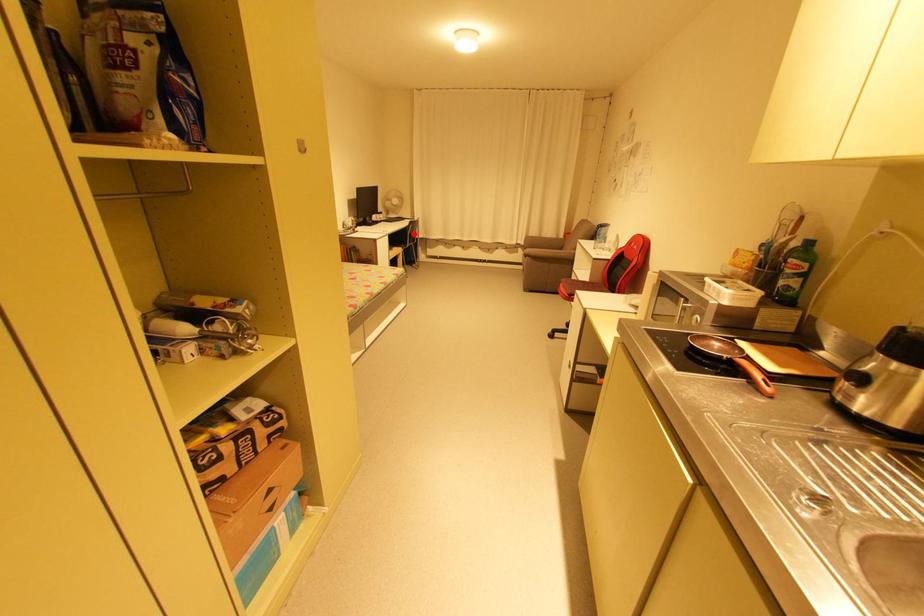
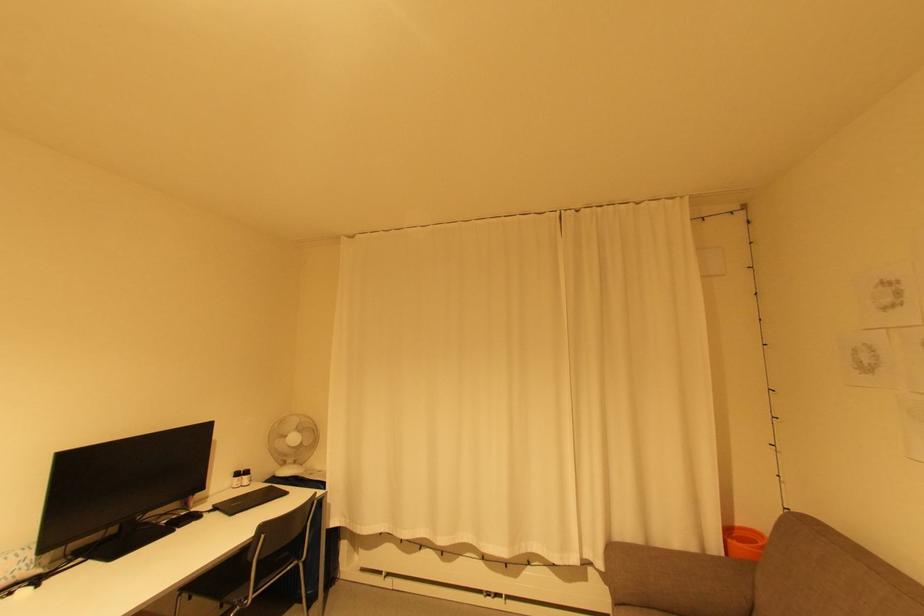
Locate, in the second image, the point that corresponds to the highlighted location in the first image.

(262, 562)